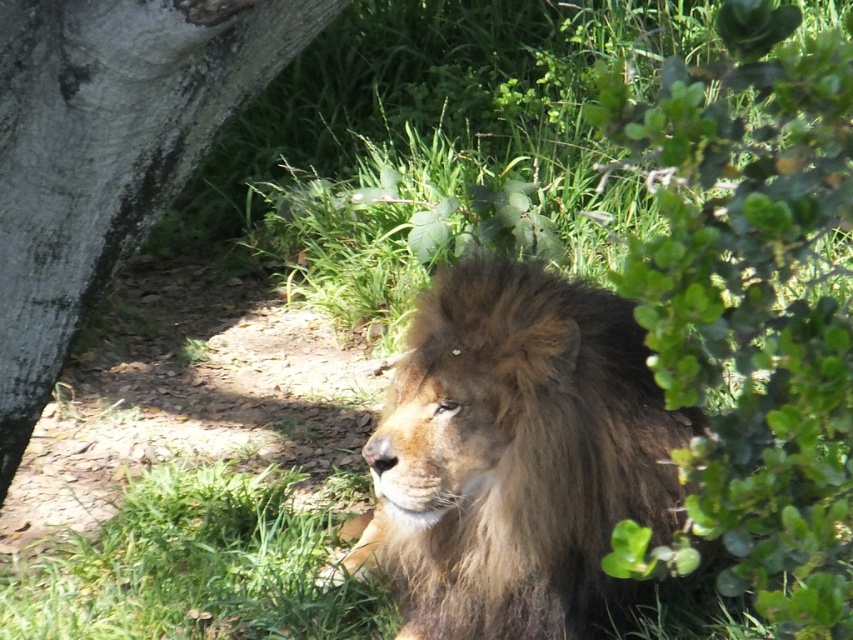
Based on the photo, is brown furry lion at center shorter than gray rough bark tree at left?

Result: Incorrect, brown furry lion at center's height does not fall short of gray rough bark tree at left's.

Which is more to the right, brown furry lion at center or gray rough bark tree at left?

Positioned to the right is brown furry lion at center.

Between point (590, 381) and point (149, 125), which one is positioned in front?

Point (149, 125) is in front.

At what (x,y) coordinates should I click in order to perform the action: click on brown furry lion at center. Please return your answer as a coordinate pair (x, y). Looking at the image, I should click on (515, 456).

Can you confirm if green leafy bush at right is positioned to the left of gray rough bark tree at left?

In fact, green leafy bush at right is to the right of gray rough bark tree at left.

Which is in front, point (685, 195) or point (241, 36)?

Positioned in front is point (685, 195).

At what (x,y) coordinates should I click in order to perform the action: click on green leafy bush at right. Please return your answer as a coordinate pair (x, y). The image size is (853, 640). Looking at the image, I should click on (751, 310).

Does point (670, 99) lie behind point (523, 605)?

No, (670, 99) is in front of (523, 605).

You are a GUI agent. You are given a task and a screenshot of the screen. Output one action in this format:
    pyautogui.click(x=<x>, y=<y>)
    Task: Click on the green leafy bush at right
    The height and width of the screenshot is (640, 853).
    Given the screenshot: What is the action you would take?
    pyautogui.click(x=751, y=310)